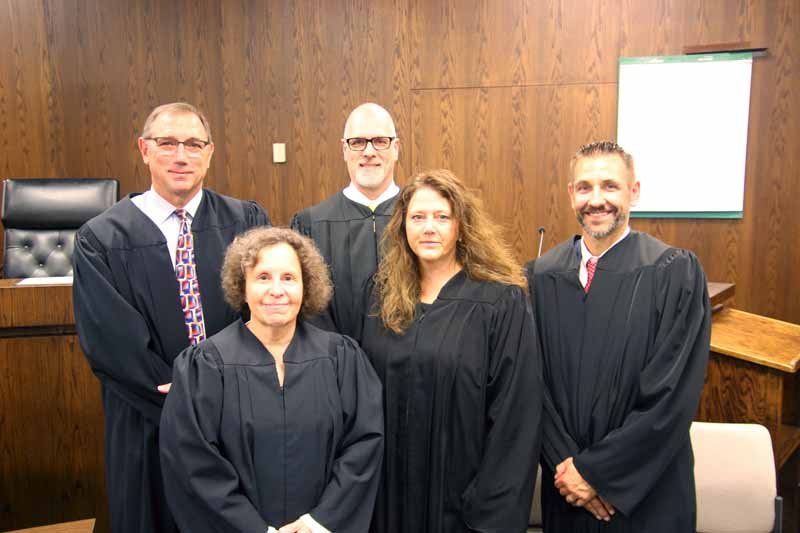
This screenshot has height=533, width=800. Identify the location of chair. 50,222.